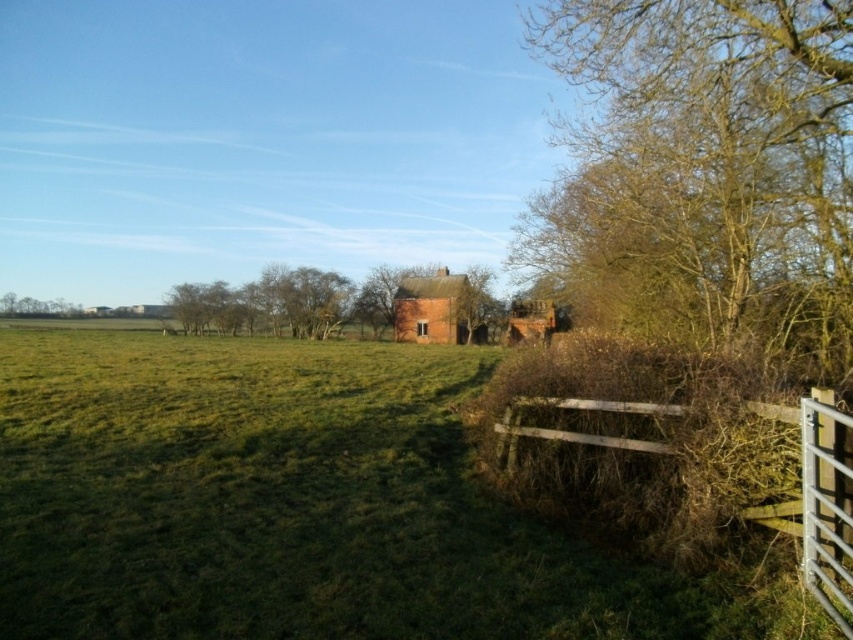
Does brick house at center appear on the right side of rustic wooden barn at center?

No, brick house at center is not to the right of rustic wooden barn at center.

I want to click on brick house at center, so click(432, 308).

Locate an element on the screen. brick house at center is located at coordinates (432, 308).

Between point (807, 579) and point (410, 321), which one is positioned in front?

Positioned in front is point (807, 579).

Is wooden gate at lower right positioned in front of brick house at center?

Yes, wooden gate at lower right is in front of brick house at center.

This screenshot has height=640, width=853. What do you see at coordinates (816, 500) in the screenshot?
I see `wooden gate at lower right` at bounding box center [816, 500].

Where is `wooden gate at lower right`? The height and width of the screenshot is (640, 853). wooden gate at lower right is located at coordinates (816, 500).

Is brown leafless tree at upper right above brick house at center?

Yes, brown leafless tree at upper right is above brick house at center.

Who is higher up, brown leafless tree at upper right or brick house at center?

Positioned higher is brown leafless tree at upper right.

Does point (706, 58) come behind point (428, 305)?

No, it is not.

Identify the location of brown leafless tree at upper right. The width and height of the screenshot is (853, 640). (711, 161).